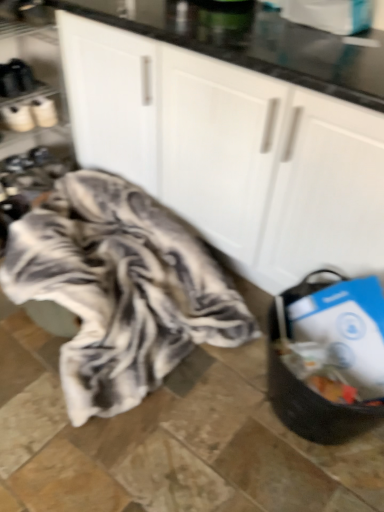
Question: Is fluffy white blanket at center not close to black matte shoe rack at left?

Choices:
 (A) no
 (B) yes

Answer: (A)

Question: Can you confirm if fluffy white blanket at center is shorter than black matte shoe rack at left?

Choices:
 (A) yes
 (B) no

Answer: (A)

Question: Would you say fluffy white blanket at center contains black matte shoe rack at left?

Choices:
 (A) no
 (B) yes

Answer: (A)

Question: Does fluffy white blanket at center have a greater width compared to black matte shoe rack at left?

Choices:
 (A) yes
 (B) no

Answer: (A)

Question: Does fluffy white blanket at center appear on the left side of black matte shoe rack at left?

Choices:
 (A) yes
 (B) no

Answer: (B)

Question: Is black matte shoe rack at left situated inside fluffy white blanket at center or outside?

Choices:
 (A) inside
 (B) outside

Answer: (B)

Question: Is black matte shoe rack at left to the left or to the right of fluffy white blanket at center in the image?

Choices:
 (A) right
 (B) left

Answer: (B)

Question: From their relative heights in the image, would you say black matte shoe rack at left is taller or shorter than fluffy white blanket at center?

Choices:
 (A) tall
 (B) short

Answer: (A)

Question: From a real-world perspective, is black matte shoe rack at left physically located above or below fluffy white blanket at center?

Choices:
 (A) below
 (B) above

Answer: (B)

Question: Does point (119, 155) appear closer or farther from the camera than point (39, 52)?

Choices:
 (A) farther
 (B) closer

Answer: (B)

Question: In terms of height, does white matte cabinet at center look taller or shorter compared to black matte shoe rack at left?

Choices:
 (A) tall
 (B) short

Answer: (A)

Question: Considering the positions of white matte cabinet at center and black matte shoe rack at left in the image, is white matte cabinet at center wider or thinner than black matte shoe rack at left?

Choices:
 (A) wide
 (B) thin

Answer: (A)

Question: Is white matte cabinet at center bigger or smaller than black matte shoe rack at left?

Choices:
 (A) small
 (B) big

Answer: (B)

Question: From a real-world perspective, is fluffy white blanket at center physically located above or below black matte shoe rack at left?

Choices:
 (A) above
 (B) below

Answer: (B)

Question: Based on their sizes in the image, would you say fluffy white blanket at center is bigger or smaller than black matte shoe rack at left?

Choices:
 (A) big
 (B) small

Answer: (A)